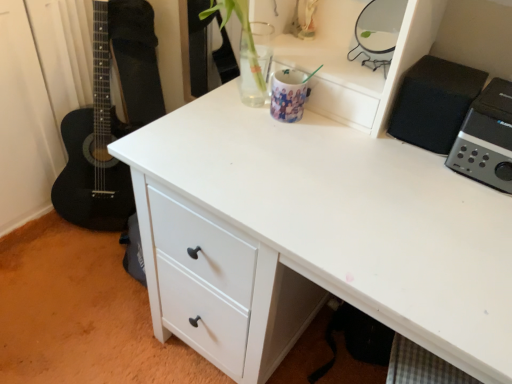
Question: In the image, is black matte speaker at upper right, which ranks as the third appliance in left-to-right order, on the left side or the right side of silver metallic speaker at upper right, the fourth appliance from the left?

Choices:
 (A) left
 (B) right

Answer: (A)

Question: Do you think black matte speaker at upper right, the second appliance from the right, is within silver metallic speaker at upper right, which ranks as the 1th appliance in right-to-left order, or outside of it?

Choices:
 (A) inside
 (B) outside

Answer: (B)

Question: Estimate the real-world distances between objects in this image. Which object is farther from the metallic silver mirror at upper right, acting as the 2th appliance starting from the left?

Choices:
 (A) silver metallic speaker at upper right, the fourth appliance from the left
 (B) black matte speaker at upper right, the second appliance from the right
 (C) glossy ceramic mug at upper center, marked as the first appliance in a left-to-right arrangement

Answer: (A)

Question: Which is nearer to the metallic silver mirror at upper right, acting as the 3th appliance starting from the right?

Choices:
 (A) black matte speaker at upper right, which ranks as the third appliance in left-to-right order
 (B) silver metallic speaker at upper right, which ranks as the 1th appliance in right-to-left order
 (C) glossy ceramic mug at upper center, arranged as the fourth appliance when viewed from the right

Answer: (A)